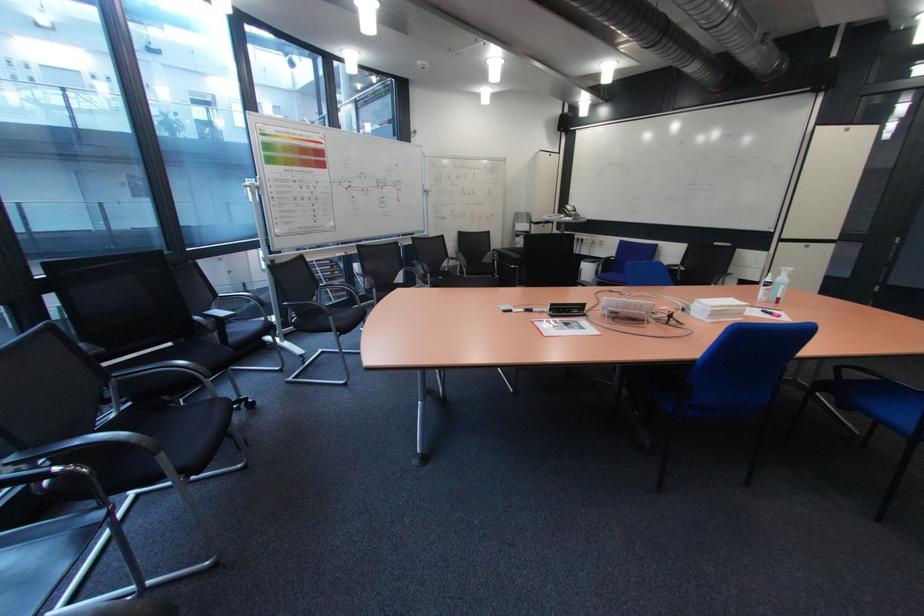
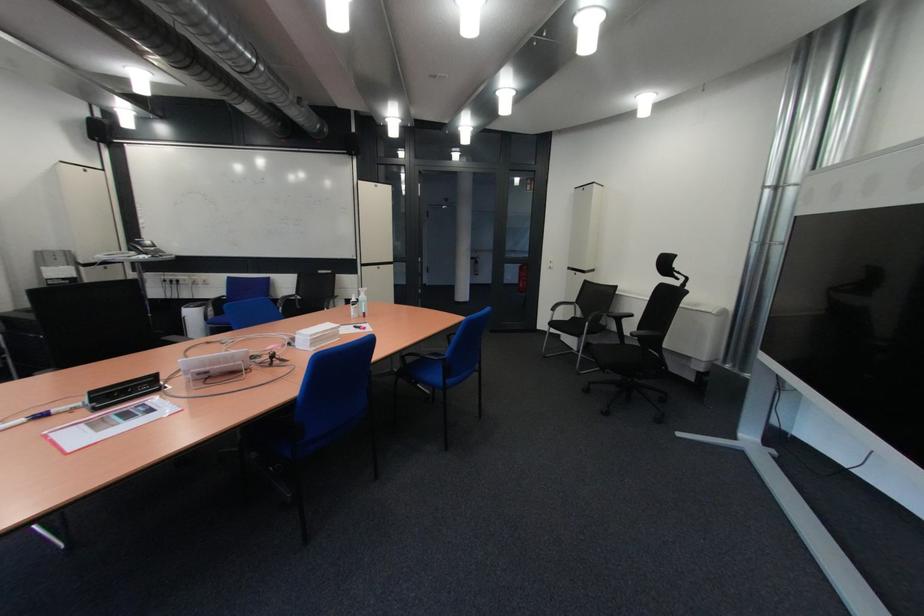
Question: How did the camera likely rotate?

Choices:
 (A) Left
 (B) Right
 (C) Up
 (D) Down

Answer: (B)